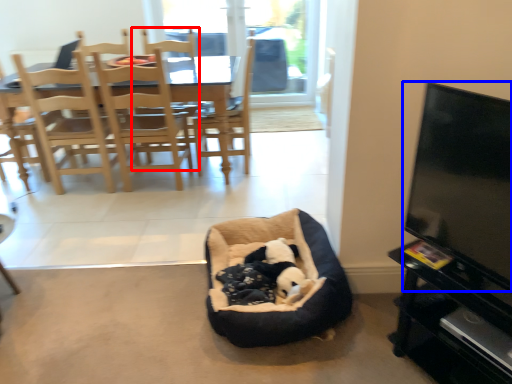
Question: Which object is closer to the camera taking this photo, armchair (highlighted by a red box) or television (highlighted by a blue box)?

Choices:
 (A) armchair
 (B) television

Answer: (B)